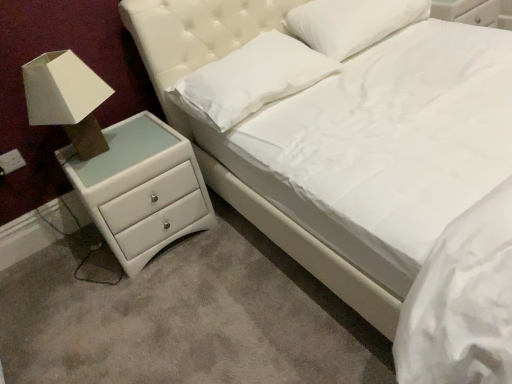
Question: Is white soft pillow at upper center, which appears as the first pillow when viewed from the left, not within white fabric lampshade at left?

Choices:
 (A) yes
 (B) no

Answer: (A)

Question: From a real-world perspective, is white soft pillow at upper center, positioned as the 2th pillow in right-to-left order, positioned over white fabric lampshade at left based on gravity?

Choices:
 (A) yes
 (B) no

Answer: (B)

Question: Is white soft pillow at upper center, positioned as the 2th pillow in right-to-left order, wider than white fabric lampshade at left?

Choices:
 (A) no
 (B) yes

Answer: (B)

Question: Are white soft pillow at upper center, positioned as the 2th pillow in right-to-left order, and white fabric lampshade at left beside each other?

Choices:
 (A) no
 (B) yes

Answer: (A)

Question: Considering the relative positions of white soft pillow at upper center, which appears as the first pillow when viewed from the left, and white fabric lampshade at left in the image provided, is white soft pillow at upper center, which appears as the first pillow when viewed from the left, in front of white fabric lampshade at left?

Choices:
 (A) no
 (B) yes

Answer: (A)

Question: Does white soft pillow at upper center, positioned as the 2th pillow in right-to-left order, turn towards white fabric lampshade at left?

Choices:
 (A) yes
 (B) no

Answer: (B)

Question: Is there a large distance between white soft pillow at upper center, which ranks as the second pillow in left-to-right order, and white soft pillow at upper center, positioned as the 2th pillow in right-to-left order?

Choices:
 (A) yes
 (B) no

Answer: (B)

Question: Can you confirm if white soft pillow at upper center, the first pillow positioned from the right, is taller than white soft pillow at upper center, which appears as the first pillow when viewed from the left?

Choices:
 (A) no
 (B) yes

Answer: (B)

Question: Does white soft pillow at upper center, which ranks as the second pillow in left-to-right order, have a lesser width compared to white soft pillow at upper center, positioned as the 2th pillow in right-to-left order?

Choices:
 (A) no
 (B) yes

Answer: (B)

Question: From a real-world perspective, is white soft pillow at upper center, the first pillow positioned from the right, positioned over white soft pillow at upper center, which appears as the first pillow when viewed from the left, based on gravity?

Choices:
 (A) no
 (B) yes

Answer: (B)

Question: Is white soft pillow at upper center, which ranks as the second pillow in left-to-right order, smaller than white soft pillow at upper center, positioned as the 2th pillow in right-to-left order?

Choices:
 (A) yes
 (B) no

Answer: (B)

Question: Is white soft pillow at upper center, which appears as the first pillow when viewed from the left, at the back of white soft pillow at upper center, the first pillow positioned from the right?

Choices:
 (A) yes
 (B) no

Answer: (B)

Question: Is white soft pillow at upper center, which ranks as the second pillow in left-to-right order, oriented away from white fabric lampshade at left?

Choices:
 (A) no
 (B) yes

Answer: (A)